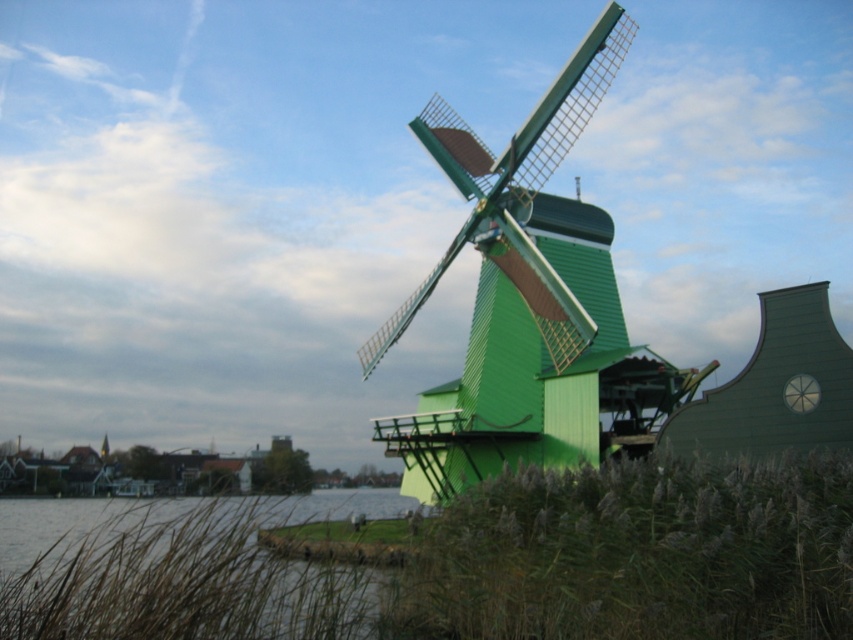
You are standing in the middle of the grassy area and want to take a photo of the green wooden windmill at center. To avoid including the green grass at lower right in your photo, which direction should you move?

You should move to the left side of the green wooden windmill at center because the green grass at lower right is positioned on the right side of it, so moving left would keep the windmill in frame while excluding the grass.

From the picture: You are a tourist visiting the windmill and want to take a photo that includes both the clear water at lower left and the green wooden windmill at center. Which object should you focus on first to ensure both are in frame?

The clear water at lower left is larger in size than the green wooden windmill at center, so you should focus on the clear water at lower left first to ensure both fit in the frame.

You are standing at the edge of the canal looking at the green wooden windmill at center and the green grass at lower right. Which object is taller?

The green wooden windmill at center is taller than the green grass at lower right.